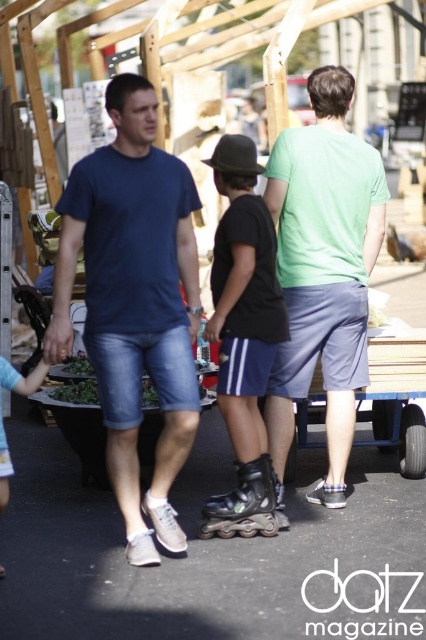
Question: Which point is farther to the camera?

Choices:
 (A) (273, 248)
 (B) (339, 461)
 (C) (69, 230)

Answer: (B)

Question: Is denim shorts at center thinner than black matte roller skates at center?

Choices:
 (A) yes
 (B) no

Answer: (B)

Question: Can you confirm if denim shorts at center is positioned to the left of green matte t-shirt at center?

Choices:
 (A) no
 (B) yes

Answer: (B)

Question: Considering the real-world distances, which object is closest to the blue denim shorts at center?

Choices:
 (A) black matte roller skates at center
 (B) black plastic roller skate at lower center
 (C) light blue denim shorts at lower left
 (D) green matte t-shirt at center

Answer: (A)

Question: Among these points, which one is farthest from the camera?

Choices:
 (A) (242, 484)
 (B) (213, 317)
 (C) (273, 168)
 (D) (336, 449)

Answer: (D)

Question: Where is denim shorts at center located in relation to light blue denim shorts at lower left in the image?

Choices:
 (A) above
 (B) below

Answer: (A)